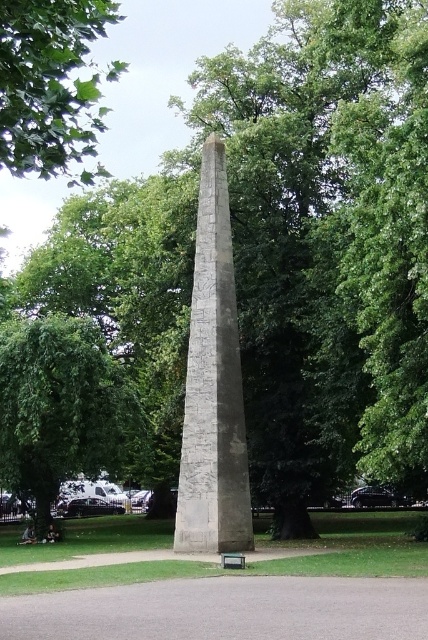
Which is below, green leafy tree at upper left or green painted wood park bench at lower center?

green painted wood park bench at lower center

Does point (41, 77) come in front of point (222, 557)?

Yes.

Where is `green leafy tree at upper left`? This screenshot has height=640, width=428. green leafy tree at upper left is located at coordinates (51, 84).

Can you confirm if green leafy tree at lower left is positioned to the left of green leafy tree at upper left?

Indeed, green leafy tree at lower left is positioned on the left side of green leafy tree at upper left.

Does green leafy tree at lower left appear on the right side of green leafy tree at upper left?

In fact, green leafy tree at lower left is to the left of green leafy tree at upper left.

Locate an element on the screen. This screenshot has width=428, height=640. green leafy tree at lower left is located at coordinates [62, 406].

Which is below, green leafy tree at lower left or green painted wood park bench at lower center?

green painted wood park bench at lower center is lower down.

Is point (88, 470) positioned in front of point (225, 557)?

No, (88, 470) is further to viewer.

Where is `green leafy tree at lower left`? The image size is (428, 640). green leafy tree at lower left is located at coordinates (62, 406).

You are a GUI agent. You are given a task and a screenshot of the screen. Output one action in this format:
    pyautogui.click(x=<x>, y=<y>)
    Task: Click on the green leafy tree at lower left
    The image size is (428, 640).
    Given the screenshot: What is the action you would take?
    pyautogui.click(x=62, y=406)